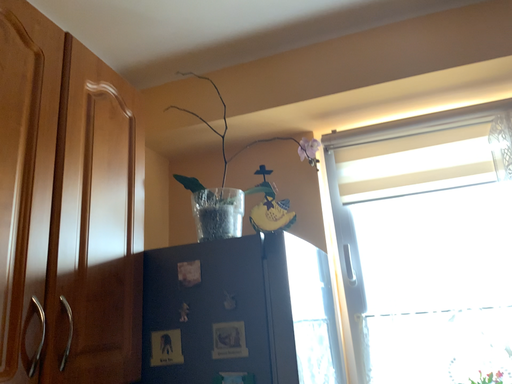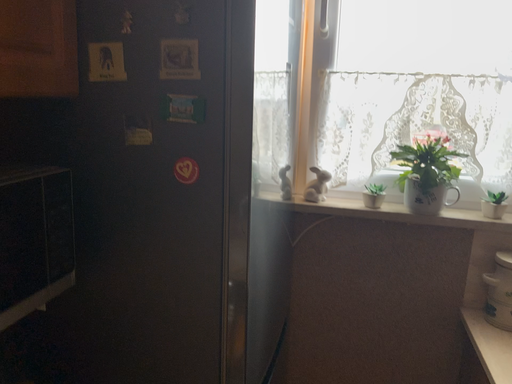
Question: How did the camera likely rotate when shooting the video?

Choices:
 (A) rotated downward
 (B) rotated upward

Answer: (A)